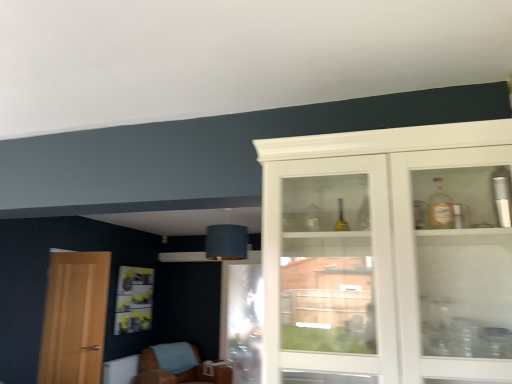
Where is `brown leather chair at lower left`? This screenshot has width=512, height=384. brown leather chair at lower left is located at coordinates (179, 372).

The image size is (512, 384). Describe the element at coordinates (388, 255) in the screenshot. I see `white glass cabinet at right` at that location.

Where is `transparent glass screen door at lower center`? The height and width of the screenshot is (384, 512). transparent glass screen door at lower center is located at coordinates (242, 321).

Are white glass cabinet at right and light brown wooden door at left beside each other?

There is a gap between white glass cabinet at right and light brown wooden door at left.

Image resolution: width=512 pixels, height=384 pixels. What are the coordinates of `cabinetry above the light brown wooden door at left (from the image's perspective)` in the screenshot? It's located at (388, 255).

From the image's perspective, between white glass cabinet at right and light brown wooden door at left, which one is located above?

white glass cabinet at right.

From a real-world perspective, who is located higher, white glass cabinet at right or light brown wooden door at left?

white glass cabinet at right is physically above.

Is brown leather chair at lower left facing towards transparent glass screen door at lower center?

No.

Can you confirm if brown leather chair at lower left is taller than transparent glass screen door at lower center?

In fact, brown leather chair at lower left may be shorter than transparent glass screen door at lower center.

Which object is thinner, brown leather chair at lower left or transparent glass screen door at lower center?

transparent glass screen door at lower center is thinner.

Can you confirm if light brown wooden door at left is wider than transparent glass screen door at lower center?

Indeed, light brown wooden door at left has a greater width compared to transparent glass screen door at lower center.

From the image's perspective, is light brown wooden door at left positioned above or below transparent glass screen door at lower center?

Based on their image positions, light brown wooden door at left is located above transparent glass screen door at lower center.

Does light brown wooden door at left have a lesser height compared to transparent glass screen door at lower center?

Yes, light brown wooden door at left is shorter than transparent glass screen door at lower center.

In terms of size, does light brown wooden door at left appear bigger or smaller than transparent glass screen door at lower center?

light brown wooden door at left is smaller than transparent glass screen door at lower center.

Which is further, (256, 376) or (156, 370)?

Point (156, 370)

This screenshot has width=512, height=384. There is a brown leather chair at lower left. Identify the location of screen door above it (from a real-world perspective). (242, 321).

Does transparent glass screen door at lower center have a lesser height compared to brown leather chair at lower left?

Incorrect, the height of transparent glass screen door at lower center does not fall short of that of brown leather chair at lower left.

In the image, is transparent glass screen door at lower center positioned in front of or behind brown leather chair at lower left?

Visually, transparent glass screen door at lower center is located behind brown leather chair at lower left.

How many degrees apart are the facing directions of transparent glass screen door at lower center and light brown wooden door at left?

There is a 173-degree angle between the facing directions of transparent glass screen door at lower center and light brown wooden door at left.

From a real-world perspective, between transparent glass screen door at lower center and light brown wooden door at left, who is vertically higher?

light brown wooden door at left.

Is transparent glass screen door at lower center next to light brown wooden door at left and touching it?

No, transparent glass screen door at lower center is not in contact with light brown wooden door at left.

Considering the sizes of transparent glass screen door at lower center and light brown wooden door at left in the image, is transparent glass screen door at lower center bigger or smaller than light brown wooden door at left?

Clearly, transparent glass screen door at lower center is larger in size than light brown wooden door at left.

The image size is (512, 384). Find the location of `screen door behind the white glass cabinet at right`. screen door behind the white glass cabinet at right is located at coordinates (242, 321).

Considering the positions of objects white glass cabinet at right and transparent glass screen door at lower center in the image provided, who is more to the right, white glass cabinet at right or transparent glass screen door at lower center?

Positioned to the right is white glass cabinet at right.

Considering the positions of objects white glass cabinet at right and transparent glass screen door at lower center in the image provided, who is in front, white glass cabinet at right or transparent glass screen door at lower center?

white glass cabinet at right is in front.

Looking at this image, considering the sizes of objects white glass cabinet at right and brown leather chair at lower left in the image provided, who is shorter, white glass cabinet at right or brown leather chair at lower left?

Standing shorter between the two is brown leather chair at lower left.

Is white glass cabinet at right aimed at brown leather chair at lower left?

No, white glass cabinet at right is not oriented towards brown leather chair at lower left.

From the image's perspective, which one is positioned higher, white glass cabinet at right or brown leather chair at lower left?

white glass cabinet at right appears higher in the image.

Find the location of a particular element. This screenshot has height=384, width=512. door on the left of the white glass cabinet at right is located at coordinates (74, 318).

Locate an element on the screen. Image resolution: width=512 pixels, height=384 pixels. screen door behind the brown leather chair at lower left is located at coordinates (242, 321).

In the scene shown: Based on their spatial positions, is white glass cabinet at right or brown leather chair at lower left further from transparent glass screen door at lower center?

white glass cabinet at right is positioned further to the anchor transparent glass screen door at lower center.

Estimate the real-world distances between objects in this image. Which object is further from transparent glass screen door at lower center, brown leather chair at lower left or white glass cabinet at right?

white glass cabinet at right is positioned further to the anchor transparent glass screen door at lower center.

Which object lies further to the anchor point transparent glass screen door at lower center, brown leather chair at lower left or light brown wooden door at left?

light brown wooden door at left is positioned further to the anchor transparent glass screen door at lower center.

From the image, which object appears to be nearer to brown leather chair at lower left, light brown wooden door at left or white glass cabinet at right?

light brown wooden door at left is closer to brown leather chair at lower left.

Estimate the real-world distances between objects in this image. Which object is further from white glass cabinet at right, light brown wooden door at left or brown leather chair at lower left?

brown leather chair at lower left is further to white glass cabinet at right.

Considering their positions, is white glass cabinet at right positioned closer to light brown wooden door at left than brown leather chair at lower left?

brown leather chair at lower left.

Looking at the image, which one is located closer to white glass cabinet at right, transparent glass screen door at lower center or brown leather chair at lower left?

Among the two, transparent glass screen door at lower center is located nearer to white glass cabinet at right.

Estimate the real-world distances between objects in this image. Which object is closer to transparent glass screen door at lower center, light brown wooden door at left or white glass cabinet at right?

light brown wooden door at left is closer to transparent glass screen door at lower center.

Locate an element on the screen. This screenshot has width=512, height=384. door between white glass cabinet at right and brown leather chair at lower left in the front-back direction is located at coordinates (74, 318).

Identify the location of chair located between light brown wooden door at left and transparent glass screen door at lower center in the left-right direction. (179, 372).

At what (x,y) coordinates should I click in order to perform the action: click on door between white glass cabinet at right and transparent glass screen door at lower center from front to back. Please return your answer as a coordinate pair (x, y). This screenshot has height=384, width=512. Looking at the image, I should click on (74, 318).

Locate an element on the screen. chair located between white glass cabinet at right and transparent glass screen door at lower center in the depth direction is located at coordinates (179, 372).